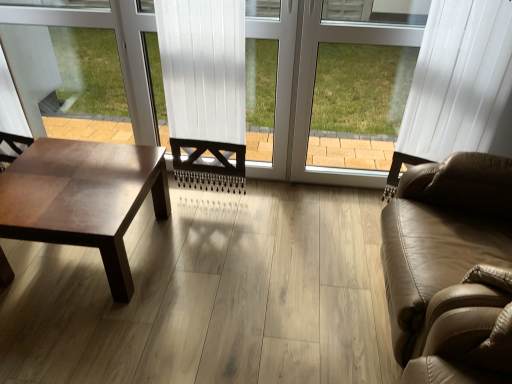
Describe the element at coordinates (83, 198) in the screenshot. This screenshot has width=512, height=384. I see `shiny brown wood coffee table at left` at that location.

The height and width of the screenshot is (384, 512). Identify the location of tan leather couch at right. (451, 270).

Considering their positions, is tan leather couch at right located in front of or behind white plastic window frame at center?

In the image, tan leather couch at right appears in front of white plastic window frame at center.

Is tan leather couch at right in contact with white plastic window frame at center?

No, tan leather couch at right is not in contact with white plastic window frame at center.

In the scene shown: From the image's perspective, between tan leather couch at right and white plastic window frame at center, which one is located above?

white plastic window frame at center appears higher in the image.

Is white plastic window frame at center at the back of tan leather couch at right?

No, tan leather couch at right's orientation is not away from white plastic window frame at center.

Considering the points (415, 358) and (60, 153), which point is behind, point (415, 358) or point (60, 153)?

The point (60, 153) is behind.

Is tan leather couch at right at the left side of shiny brown wood coffee table at left?

No, tan leather couch at right is not to the left of shiny brown wood coffee table at left.

Looking at this image, between tan leather couch at right and shiny brown wood coffee table at left, which one has smaller size?

shiny brown wood coffee table at left.

Is the surface of shiny brown wood coffee table at left in direct contact with tan leather couch at right?

No, shiny brown wood coffee table at left is not making contact with tan leather couch at right.

Between point (111, 199) and point (416, 199), which one is positioned behind?

The point (111, 199) is more distant.

From a real-world perspective, who is located lower, shiny brown wood coffee table at left or tan leather couch at right?

shiny brown wood coffee table at left is physically lower.

Does shiny brown wood coffee table at left have a smaller size compared to tan leather couch at right?

Yes.

From a real-world perspective, which object rests below the other?

shiny brown wood coffee table at left is physically lower.

Is shiny brown wood coffee table at left touching white plastic window frame at center?

No, shiny brown wood coffee table at left is not next to white plastic window frame at center.

Considering the relative sizes of shiny brown wood coffee table at left and white plastic window frame at center in the image provided, is shiny brown wood coffee table at left taller than white plastic window frame at center?

Incorrect, the height of shiny brown wood coffee table at left is not larger of that of white plastic window frame at center.

Does shiny brown wood coffee table at left have a greater width compared to white plastic window frame at center?

Yes.

Based on the photo, from the image's perspective, is white plastic window frame at center located beneath tan leather couch at right?

Actually, white plastic window frame at center appears above tan leather couch at right in the image.

Is white plastic window frame at center far from tan leather couch at right?

No.

Which of these two, white plastic window frame at center or tan leather couch at right, stands shorter?

With less height is tan leather couch at right.

Is white plastic window frame at center positioned beyond the bounds of shiny brown wood coffee table at left?

Yes.

From the picture: How many degrees apart are the facing directions of white plastic window frame at center and shiny brown wood coffee table at left?

The angle between the facing direction of white plastic window frame at center and the facing direction of shiny brown wood coffee table at left is 0.508 degrees.

Is white plastic window frame at center to the right of shiny brown wood coffee table at left from the viewer's perspective?

Yes, white plastic window frame at center is to the right of shiny brown wood coffee table at left.

From the picture: Is white plastic window frame at center facing towards shiny brown wood coffee table at left?

No, white plastic window frame at center is not turned towards shiny brown wood coffee table at left.

This screenshot has width=512, height=384. Identify the location of studio couch directly beneath the white plastic window frame at center (from a real-world perspective). (451, 270).

The height and width of the screenshot is (384, 512). Identify the location of studio couch that appears on the right of shiny brown wood coffee table at left. (451, 270).

Which object lies nearer to the anchor point tan leather couch at right, shiny brown wood coffee table at left or white plastic window frame at center?

The object closer to tan leather couch at right is white plastic window frame at center.

Which object lies nearer to the anchor point shiny brown wood coffee table at left, tan leather couch at right or white plastic window frame at center?

white plastic window frame at center is closer to shiny brown wood coffee table at left.

Which object lies nearer to the anchor point white plastic window frame at center, shiny brown wood coffee table at left or tan leather couch at right?

Based on the image, tan leather couch at right appears to be nearer to white plastic window frame at center.

Looking at the image, which one is located further to shiny brown wood coffee table at left, white plastic window frame at center or tan leather couch at right?

The object further to shiny brown wood coffee table at left is tan leather couch at right.

When comparing their distances from white plastic window frame at center, does tan leather couch at right or shiny brown wood coffee table at left seem further?

shiny brown wood coffee table at left.

Estimate the real-world distances between objects in this image. Which object is further from tan leather couch at right, white plastic window frame at center or shiny brown wood coffee table at left?

shiny brown wood coffee table at left lies further to tan leather couch at right than the other object.

Locate an element on the screen. The width and height of the screenshot is (512, 384). window frame located between shiny brown wood coffee table at left and tan leather couch at right in the left-right direction is located at coordinates (313, 89).